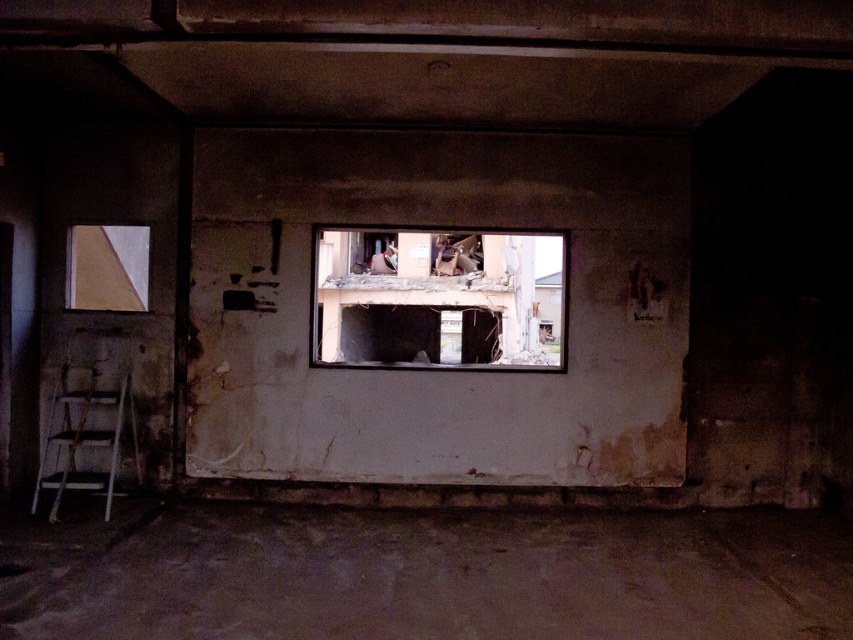
Question: Does transparent glass window at center appear on the right side of matte glass window at upper left?

Choices:
 (A) no
 (B) yes

Answer: (B)

Question: Can you confirm if transparent glass window at center is thinner than white wooden ladder at lower left?

Choices:
 (A) no
 (B) yes

Answer: (A)

Question: Does transparent glass window at center have a lesser width compared to matte glass window at upper left?

Choices:
 (A) yes
 (B) no

Answer: (B)

Question: Estimate the real-world distances between objects in this image. Which object is farther from the transparent glass window at center?

Choices:
 (A) white wooden ladder at lower left
 (B) matte glass window at upper left

Answer: (B)

Question: Which of the following is the closest to the observer?

Choices:
 (A) matte glass window at upper left
 (B) transparent glass window at center

Answer: (B)

Question: Which point is closer to the camera?

Choices:
 (A) (105, 508)
 (B) (486, 332)

Answer: (A)